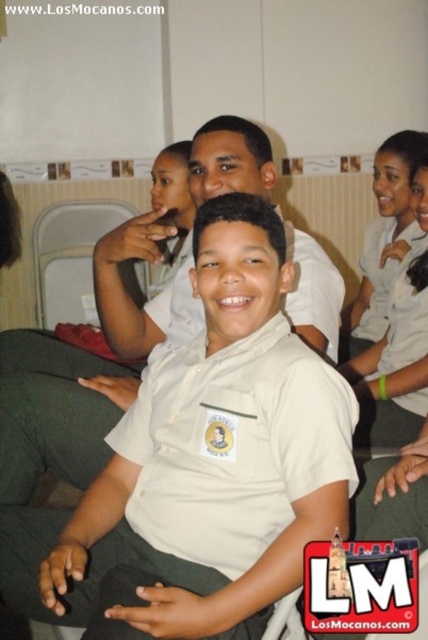
Who is more forward, (205, 488) or (175, 285)?

Positioned in front is point (205, 488).

Who is positioned more to the left, white uniform shirt at center or white matte uniform at center?

white matte uniform at center is more to the left.

Between point (131, 608) and point (186, 289), which one is positioned in front?

Point (131, 608)

At what (x,y) coordinates should I click in order to perform the action: click on white uniform shirt at center. Please return your answer as a coordinate pair (x, y). The height and width of the screenshot is (640, 428). Looking at the image, I should click on (222, 444).